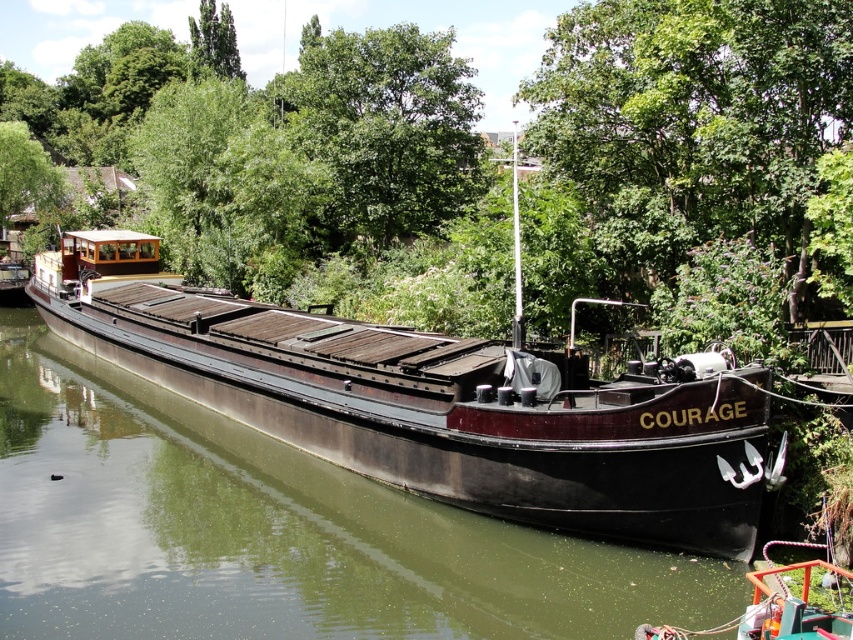
Question: Which point appears closest to the camera in this image?

Choices:
 (A) (305, 268)
 (B) (357, 76)
 (C) (299, 316)

Answer: (C)

Question: Estimate the real-world distances between objects in this image. Which object is closer to the green leafy tree at upper center?

Choices:
 (A) dark brown wooden barge at center
 (B) green leafy tree at center

Answer: (B)

Question: Observing the image, what is the correct spatial positioning of dark brown wooden barge at center in reference to green leafy tree at upper center?

Choices:
 (A) below
 (B) above

Answer: (A)

Question: Estimate the real-world distances between objects in this image. Which object is farther from the dark brown wooden barge at center?

Choices:
 (A) green leafy tree at upper center
 (B) green leafy tree at center

Answer: (B)

Question: Observing the image, what is the correct spatial positioning of green leafy tree at center in reference to dark brown wooden barge at center?

Choices:
 (A) right
 (B) left

Answer: (A)

Question: Is green leafy tree at center above green leafy tree at upper center?

Choices:
 (A) yes
 (B) no

Answer: (B)